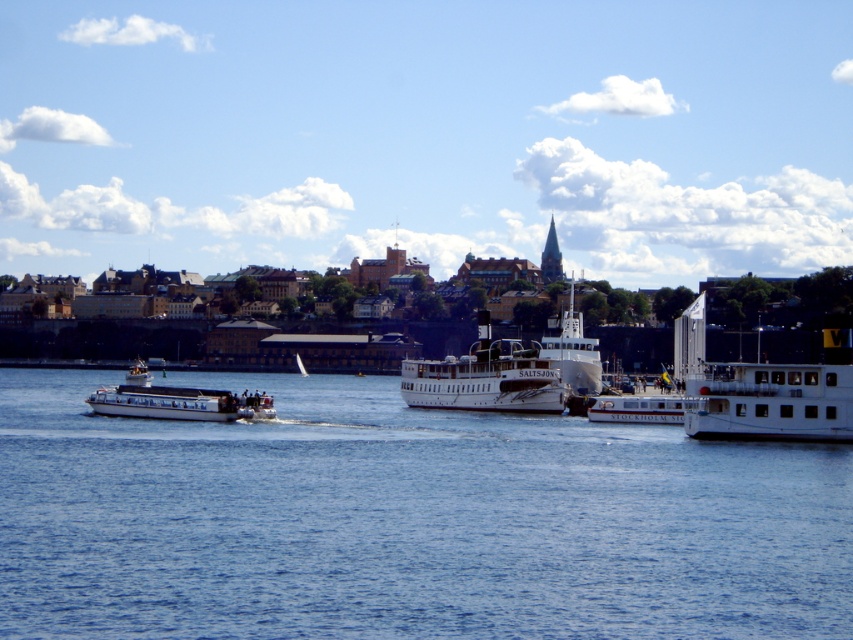
You are a photographer planning to take a photo of the waterfront scene. You want to ensure that both the white matte ferry at center and the white glossy ferry at center are clearly visible in your shot. Considering their heights, which ferry will appear smaller in the photo?

The white matte ferry at center will appear smaller in the photo because it has a lesser height compared to the white glossy ferry at center.

You are standing on the pier where the two larger ferries are docked. You notice a point marked at coordinates (177, 401). What object is located at this point?

The point at (177, 401) marks the location of the white glossy boat at left.

You are standing at the point labeled point (181, 413) and want to take a photo of the point labeled point (581, 349). However, there is a large tree blocking your view. Can you move to a position where both points are visible without obstruction?

Since point (181, 413) is closer to the camera than point (581, 349), you can move behind point (181, 413) to ensure both points are visible without obstruction.